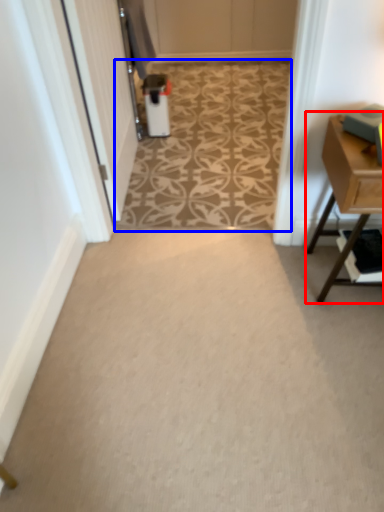
Question: Which object is closer to the camera taking this photo, table (highlighted by a red box) or pattern (highlighted by a blue box)?

Choices:
 (A) table
 (B) pattern

Answer: (A)